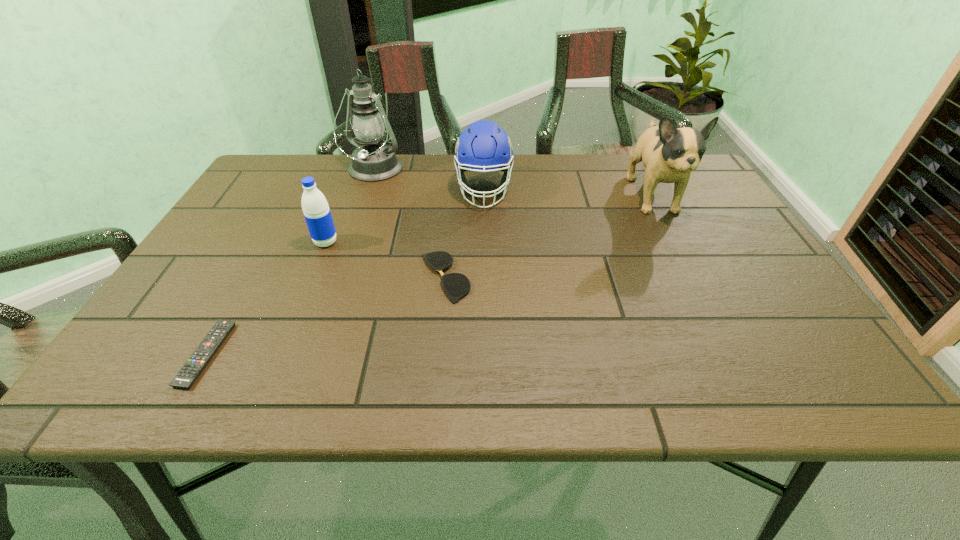
You are a GUI agent. You are given a task and a screenshot of the screen. Output one action in this format:
    pyautogui.click(x=<x>, y=<y>)
    Task: Click on the vacant space located on the front-facing side of the football helmet
    
    Given the screenshot: What is the action you would take?
    pyautogui.click(x=484, y=226)

Where is `vacant space located 0.200m on the front of the water bottle`? vacant space located 0.200m on the front of the water bottle is located at coordinates (298, 312).

Where is `free region located on the left of the spectacles`? This screenshot has height=540, width=960. free region located on the left of the spectacles is located at coordinates (238, 278).

Where is `vacant area situated on the left of the remote control`? vacant area situated on the left of the remote control is located at coordinates (158, 354).

This screenshot has height=540, width=960. In order to click on oil lamp located at the far edge in this screenshot , I will do `click(373, 161)`.

The width and height of the screenshot is (960, 540). I want to click on puppy located in the far edge section of the desktop, so click(669, 154).

Identify the location of football helmet present at the far edge. The image size is (960, 540). (483, 146).

You are a GUI agent. You are given a task and a screenshot of the screen. Output one action in this format:
    pyautogui.click(x=<x>, y=<y>)
    Task: Click on the object present at the near edge
    The height and width of the screenshot is (540, 960).
    Given the screenshot: What is the action you would take?
    pyautogui.click(x=187, y=375)

Where is `object present at the left edge`? This screenshot has height=540, width=960. object present at the left edge is located at coordinates (187, 375).

Locate an element on the screen. This screenshot has height=540, width=960. object that is at the right edge is located at coordinates pos(669,154).